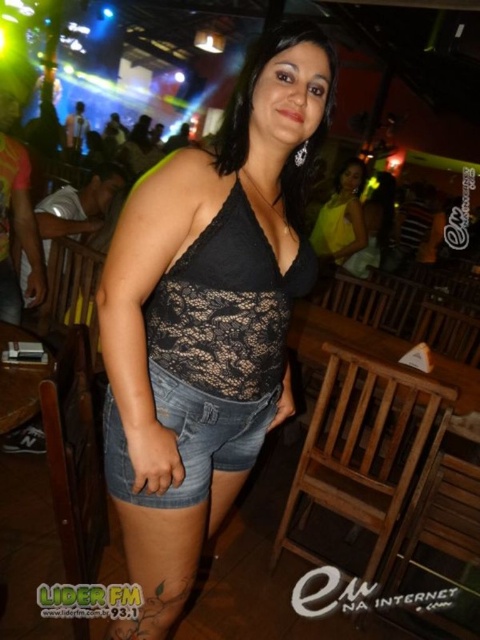
Does black lace top at center have a smaller size compared to yellow satin dress at center?

Actually, black lace top at center might be larger than yellow satin dress at center.

Which is behind, point (280, 125) or point (342, 204)?

Point (342, 204)

Find the location of `black lace top at center`. black lace top at center is located at coordinates (206, 317).

Between black lace top at center and denim shorts at center, which one appears on the right side from the viewer's perspective?

Positioned to the right is black lace top at center.

Looking at this image, can you confirm if black lace top at center is shorter than denim shorts at center?

In fact, black lace top at center may be taller than denim shorts at center.

Does point (314, 72) come farther from viewer compared to point (189, 417)?

No, it is in front of (189, 417).

The height and width of the screenshot is (640, 480). In order to click on black lace top at center in this screenshot , I will do `click(206, 317)`.

Between point (126, 484) and point (354, 163), which one is positioned in front?

Positioned in front is point (126, 484).

Can you confirm if denim shorts at center is shorter than yellow satin dress at center?

Yes.

Describe the element at coordinates (189, 438) in the screenshot. I see `denim shorts at center` at that location.

The height and width of the screenshot is (640, 480). Find the location of `denim shorts at center`. denim shorts at center is located at coordinates (189, 438).